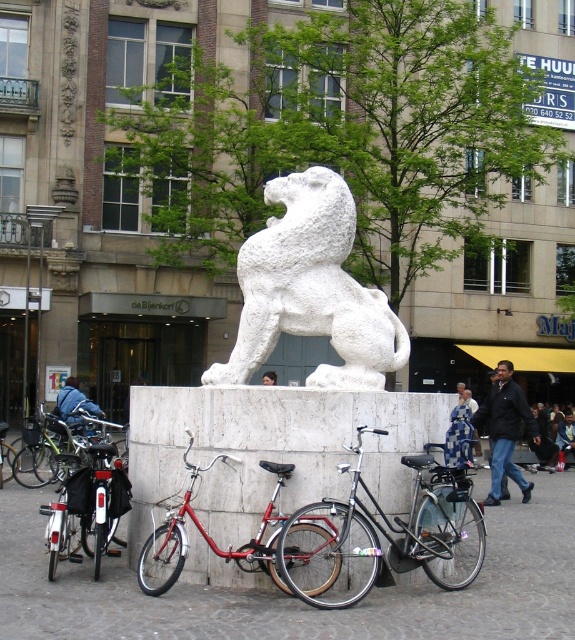
Locate an element on the screen. The image size is (575, 640). shiny black bicycle at center is located at coordinates (384, 536).

Is shiny black bicycle at center taller than shiny black bicycle at lower left?

Correct, shiny black bicycle at center is much taller as shiny black bicycle at lower left.

Who is more forward, (431, 464) or (105, 493)?

Positioned in front is point (431, 464).

I want to click on shiny black bicycle at center, so click(384, 536).

Between metallic red bicycle at center and shiny black bicycle at lower left, which one is positioned higher?

metallic red bicycle at center is higher up.

Based on the photo, measure the distance between point (x=250, y=570) and camera.

Point (x=250, y=570) is 27.92 feet away from camera.

You are a GUI agent. You are given a task and a screenshot of the screen. Output one action in this format:
    pyautogui.click(x=<x>, y=<y>)
    Task: Click on the metallic red bicycle at center
    The width and height of the screenshot is (575, 640).
    Given the screenshot: What is the action you would take?
    pyautogui.click(x=209, y=536)

Is white stone lion at center closer to the viewer compared to metallic red bicycle at center?

No, it is not.

Does point (217, 365) come closer to viewer compared to point (143, 552)?

No.

Image resolution: width=575 pixels, height=640 pixels. What are the coordinates of `white stone lion at center` in the screenshot? It's located at (310, 289).